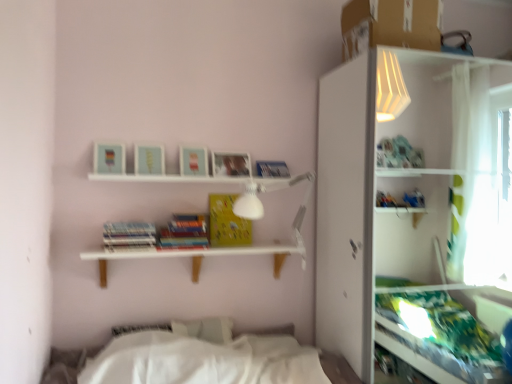
Question: Considering the relative positions of white glossy shelf at upper right and hardcover book at center, which is counted as the second paperback book, starting from the right, in the image provided, is white glossy shelf at upper right to the right of hardcover book at center, which is counted as the second paperback book, starting from the right, from the viewer's perspective?

Choices:
 (A) yes
 (B) no

Answer: (A)

Question: Can you confirm if white glossy shelf at upper right is wider than hardcover book at center, arranged as the 2th paperback book when viewed from the left?

Choices:
 (A) yes
 (B) no

Answer: (A)

Question: Considering the relative sizes of white glossy shelf at upper right and hardcover book at center, which is counted as the second paperback book, starting from the right, in the image provided, is white glossy shelf at upper right shorter than hardcover book at center, which is counted as the second paperback book, starting from the right,?

Choices:
 (A) yes
 (B) no

Answer: (B)

Question: Can you confirm if white glossy shelf at upper right is smaller than hardcover book at center, which is counted as the second paperback book, starting from the right?

Choices:
 (A) no
 (B) yes

Answer: (A)

Question: Is white glossy shelf at upper right located outside hardcover book at center, which is counted as the second paperback book, starting from the right?

Choices:
 (A) yes
 (B) no

Answer: (A)

Question: In the image, is hardcover book at center, which is counted as the second paperback book, starting from the right, on the left side or the right side of yellow matte paper at center, arranged as the third paperback book when viewed from the left?

Choices:
 (A) left
 (B) right

Answer: (A)

Question: Considering the positions of hardcover book at center, arranged as the 2th paperback book when viewed from the left, and yellow matte paper at center, arranged as the third paperback book when viewed from the left, in the image, is hardcover book at center, arranged as the 2th paperback book when viewed from the left, wider or thinner than yellow matte paper at center, arranged as the third paperback book when viewed from the left,?

Choices:
 (A) thin
 (B) wide

Answer: (B)

Question: From a real-world perspective, is hardcover book at center, arranged as the 2th paperback book when viewed from the left, positioned above or below yellow matte paper at center, arranged as the third paperback book when viewed from the left?

Choices:
 (A) above
 (B) below

Answer: (B)

Question: Is hardcover book at center, which is counted as the second paperback book, starting from the right, spatially inside yellow matte paper at center, arranged as the 1th paperback book when viewed from the right, or outside of it?

Choices:
 (A) outside
 (B) inside

Answer: (A)

Question: From a real-world perspective, relative to white glossy shelf at upper right, is hardcover books at center, the 3th paperback book in the right-to-left sequence, vertically above or below?

Choices:
 (A) above
 (B) below

Answer: (A)

Question: From the image's perspective, is hardcover books at center, positioned as the 1th paperback book in left-to-right order, located above or below white glossy shelf at upper right?

Choices:
 (A) above
 (B) below

Answer: (A)

Question: From their relative heights in the image, would you say hardcover books at center, the 3th paperback book in the right-to-left sequence, is taller or shorter than white glossy shelf at upper right?

Choices:
 (A) tall
 (B) short

Answer: (B)

Question: Is point (108, 230) closer or farther from the camera than point (354, 283)?

Choices:
 (A) closer
 (B) farther

Answer: (B)

Question: From a real-world perspective, is hardcover book at center, which is counted as the second paperback book, starting from the right, positioned above or below hardcover books at center, positioned as the 1th paperback book in left-to-right order?

Choices:
 (A) above
 (B) below

Answer: (B)

Question: In terms of size, does hardcover book at center, arranged as the 2th paperback book when viewed from the left, appear bigger or smaller than hardcover books at center, positioned as the 1th paperback book in left-to-right order?

Choices:
 (A) small
 (B) big

Answer: (A)